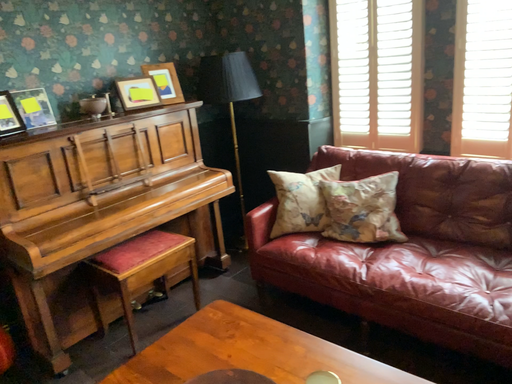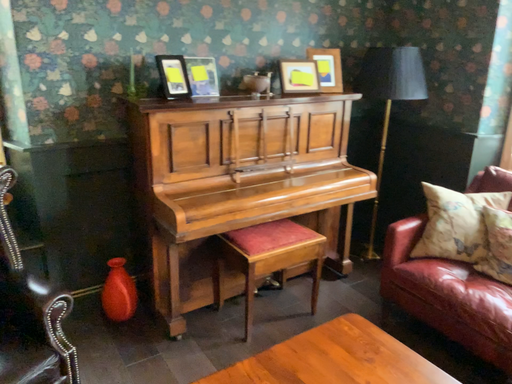
Question: How did the camera likely rotate when shooting the video?

Choices:
 (A) rotated left
 (B) rotated right

Answer: (A)